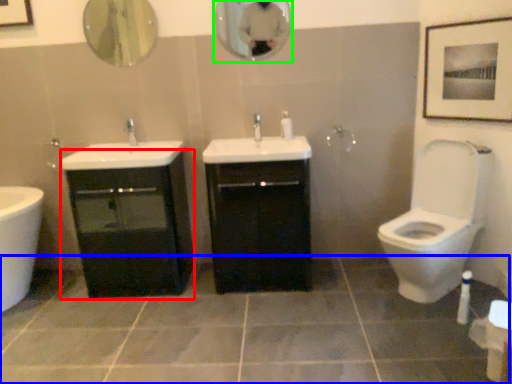
Question: Which is nearer to the bathroom cabinet (highlighted by a red box)? ceramic tile (highlighted by a blue box) or mirror (highlighted by a green box).

Choices:
 (A) ceramic tile
 (B) mirror

Answer: (A)